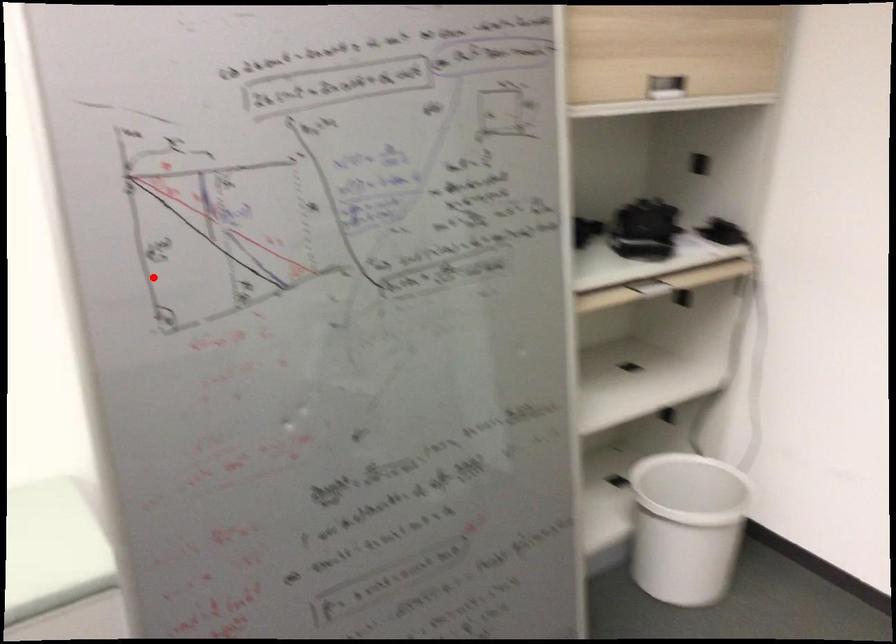
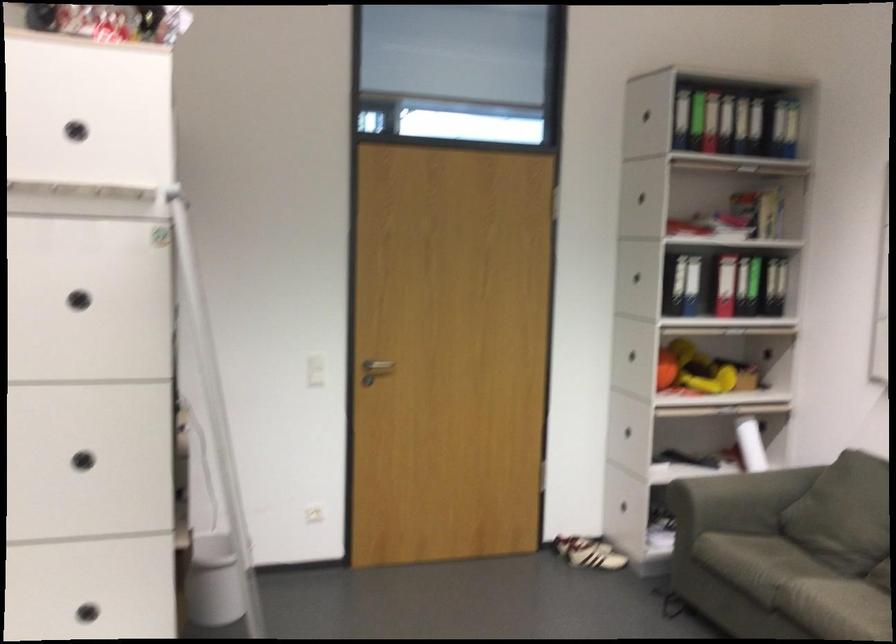
The point at the highlighted location is marked in the first image. Where is the corresponding point in the second image?

(83, 456)